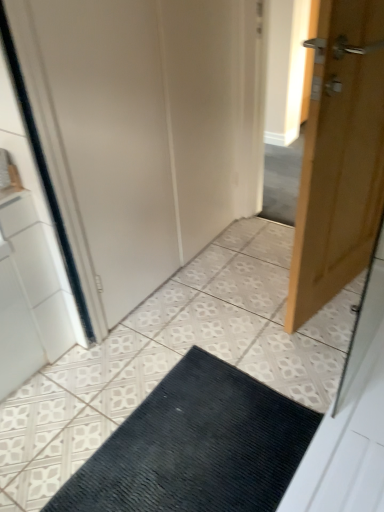
Question: From the image's perspective, is black textured mat at center on top of light brown wooden door at right?

Choices:
 (A) no
 (B) yes

Answer: (A)

Question: Does black textured mat at center have a lesser height compared to light brown wooden door at right?

Choices:
 (A) no
 (B) yes

Answer: (B)

Question: Is light brown wooden door at right at the back of black textured mat at center?

Choices:
 (A) yes
 (B) no

Answer: (B)

Question: From the image's perspective, is black textured mat at center under light brown wooden door at right?

Choices:
 (A) yes
 (B) no

Answer: (A)

Question: Does black textured mat at center touch light brown wooden door at right?

Choices:
 (A) yes
 (B) no

Answer: (B)

Question: Considering the relative positions of black textured mat at center and light brown wooden door at right in the image provided, is black textured mat at center to the right of light brown wooden door at right from the viewer's perspective?

Choices:
 (A) no
 (B) yes

Answer: (A)

Question: Can you confirm if light brown wooden door at right is smaller than white matte door at center?

Choices:
 (A) no
 (B) yes

Answer: (B)

Question: Is light brown wooden door at right oriented towards white matte door at center?

Choices:
 (A) no
 (B) yes

Answer: (B)

Question: From the image's perspective, is light brown wooden door at right under white matte door at center?

Choices:
 (A) yes
 (B) no

Answer: (A)

Question: Is the depth of light brown wooden door at right greater than that of white matte door at center?

Choices:
 (A) no
 (B) yes

Answer: (A)

Question: From a real-world perspective, does light brown wooden door at right sit lower than white matte door at center?

Choices:
 (A) no
 (B) yes

Answer: (B)

Question: Is light brown wooden door at right to the right of white matte door at center from the viewer's perspective?

Choices:
 (A) no
 (B) yes

Answer: (B)

Question: From the image's perspective, is white matte door at center above black textured mat at center?

Choices:
 (A) yes
 (B) no

Answer: (A)